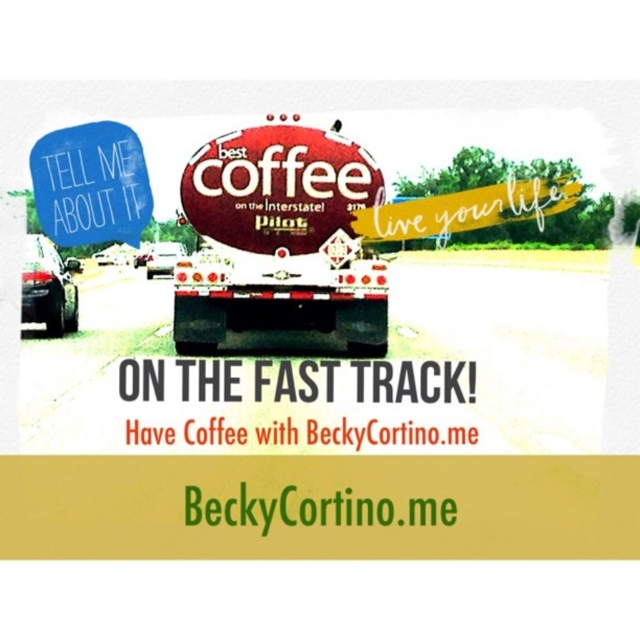
Looking at this image, is metallic red stop sign at center to the left of blue paper sign at upper left from the viewer's perspective?

No, metallic red stop sign at center is not to the left of blue paper sign at upper left.

Which of these two, metallic red stop sign at center or blue paper sign at upper left, stands shorter?

blue paper sign at upper left is shorter.

I want to click on metallic red stop sign at center, so click(x=278, y=188).

Is point (289, 136) farther from viewer compared to point (364, 344)?

That is False.

Where is `metallic red stop sign at center`? This screenshot has width=640, height=640. metallic red stop sign at center is located at coordinates (278, 188).

Which is in front, point (193, 323) or point (100, 154)?

Point (100, 154) is in front.

Can you confirm if white glossy trailer truck at center is positioned to the right of blue paper sign at upper left?

Yes, white glossy trailer truck at center is to the right of blue paper sign at upper left.

This screenshot has width=640, height=640. Identify the location of white glossy trailer truck at center. (278, 300).